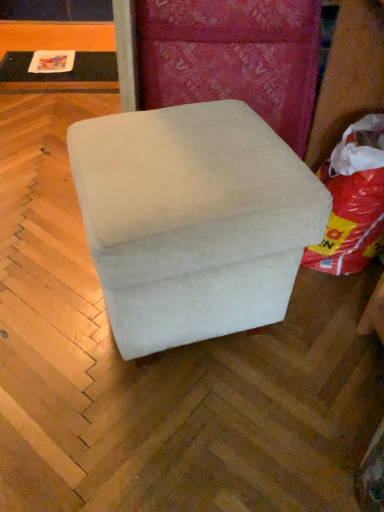
Locate an element on the screen. The image size is (384, 512). vacant space to the left of white fabric ottoman at center is located at coordinates (49, 293).